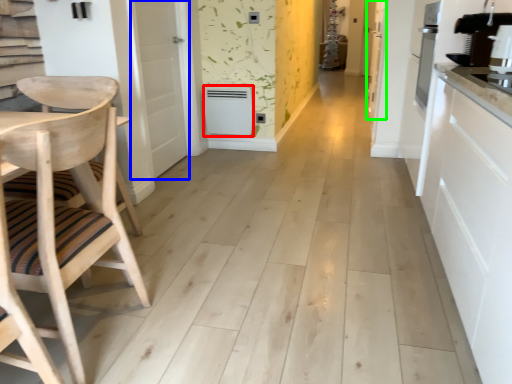
Question: Which object is the farthest from appliance (highlighted by a red box)? Choose among these: door (highlighted by a blue box) or door (highlighted by a green box).

Choices:
 (A) door
 (B) door

Answer: (B)